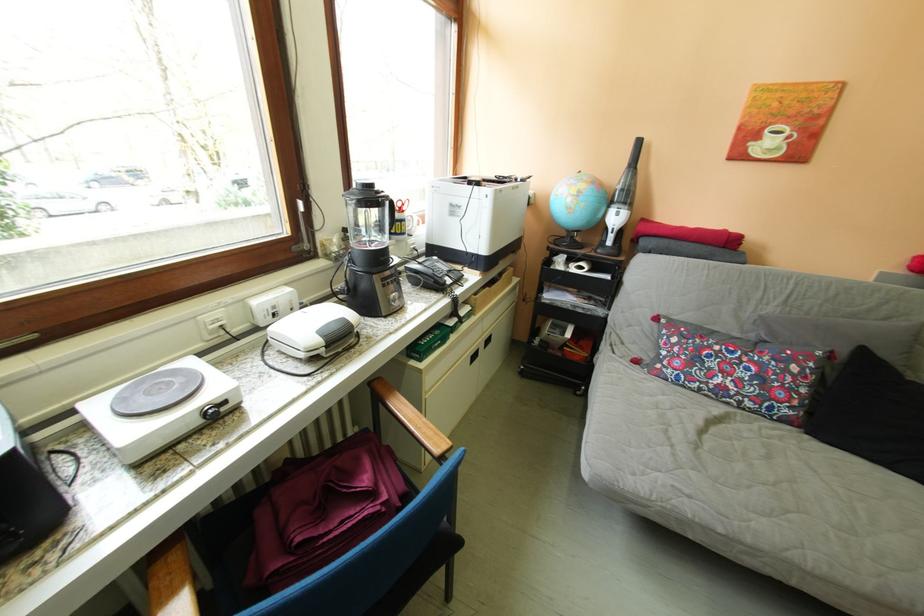
The image size is (924, 616). Describe the element at coordinates (304, 225) in the screenshot. I see `the window handle` at that location.